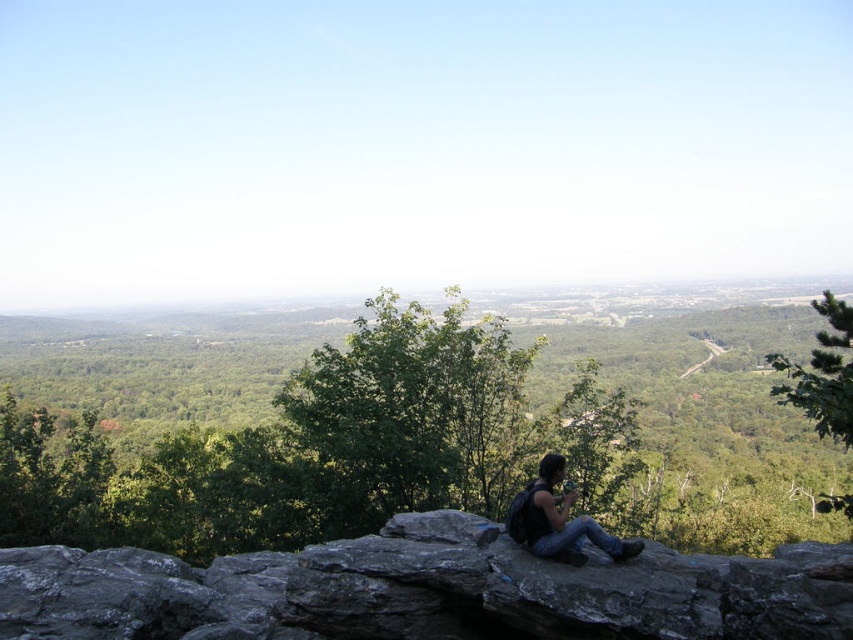
You are standing at the rocky outcrop in the foreground and want to take a photo of the green leafy tree at center. Which direction should you face to ensure the tree is in the center of your view?

The green leafy tree at center is located at point coordinates, so you should face towards the center of the image to capture it in the center of your view.

You are a hiker who wants to take a photo of the dark gray rocky cliff at center without the green leafy tree at center blocking the view. Which direction should you move to achieve this?

The green leafy tree at center is positioned under the dark gray rocky cliff at center, so moving to the left or right side of the tree would allow you to position yourself where the tree is no longer blocking the view of the cliff.

You are planning to take a photo of the dark gray rocky cliff at center and the black backpack at center from your current position. Which object will appear larger in the photo?

The dark gray rocky cliff at center will appear larger in the photo because it is much taller than the black backpack at center.